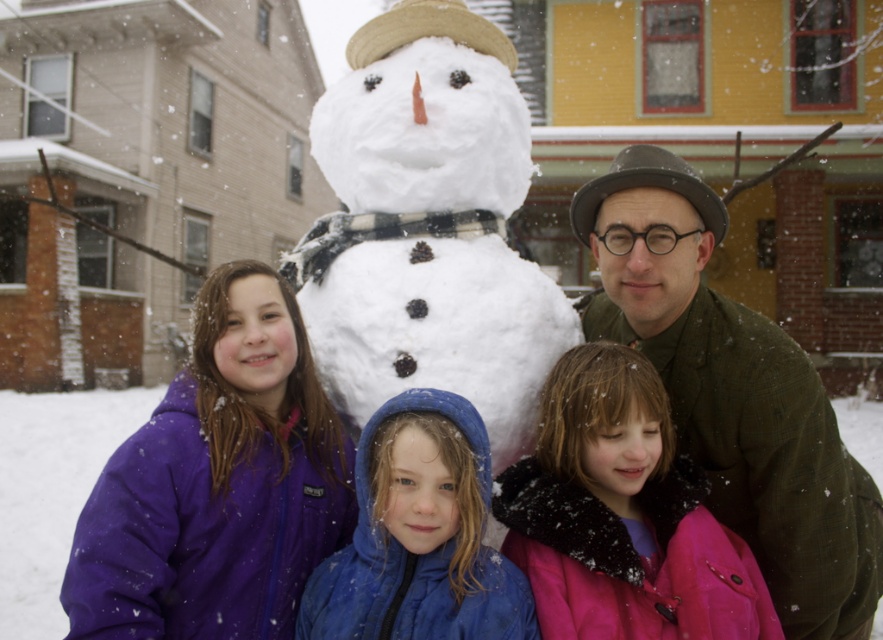
Between purple fleece jacket at lower left and blue fleece jacket at center, which one has more height?

purple fleece jacket at lower left

From the picture: Does purple fleece jacket at lower left appear over blue fleece jacket at center?

Yes, purple fleece jacket at lower left is above blue fleece jacket at center.

Is point (168, 536) behind point (395, 579)?

Yes.

Image resolution: width=883 pixels, height=640 pixels. I want to click on purple fleece jacket at lower left, so click(217, 483).

Can you confirm if purple fleece jacket at lower left is thinner than green woolen coat at center?

Indeed, purple fleece jacket at lower left has a lesser width compared to green woolen coat at center.

What do you see at coordinates (217, 483) in the screenshot? Image resolution: width=883 pixels, height=640 pixels. I see `purple fleece jacket at lower left` at bounding box center [217, 483].

This screenshot has height=640, width=883. Identify the location of purple fleece jacket at lower left. (217, 483).

Is white fluffy snowman at center above pink fur-trimmed coat at lower right?

Yes.

Does white fluffy snowman at center come behind pink fur-trimmed coat at lower right?

That is True.

Is point (396, 80) behind point (638, 408)?

Yes, point (396, 80) is behind point (638, 408).

Locate an element on the screen. white fluffy snowman at center is located at coordinates (428, 227).